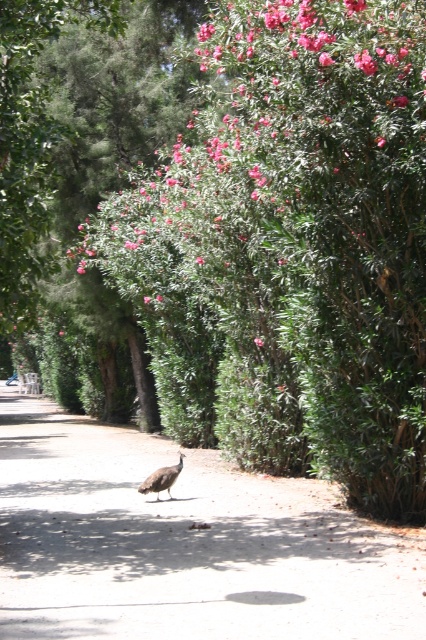
You are a photographer aiming to capture the gray feathered peacock at center and the pink matte flower at upper center in the same frame. Based on their positions, which object is closer to the left edge of the photo?

The gray feathered peacock at center is closer to the left edge of the photo because it is positioned on the left side of the pink matte flower at upper center.

A hiker is standing at the coordinates provided in the scene description. They want to walk to the brown dirt path at center. Which direction should they move?

The hiker should move towards the center of the scene to reach the brown dirt path at center since it is located at point (184, 545).

You are standing at the point with coordinates (161, 477) in the image. What object are you directly facing?

You are directly facing the gray feathered peacock at center as the point (161, 477) indicates its location.